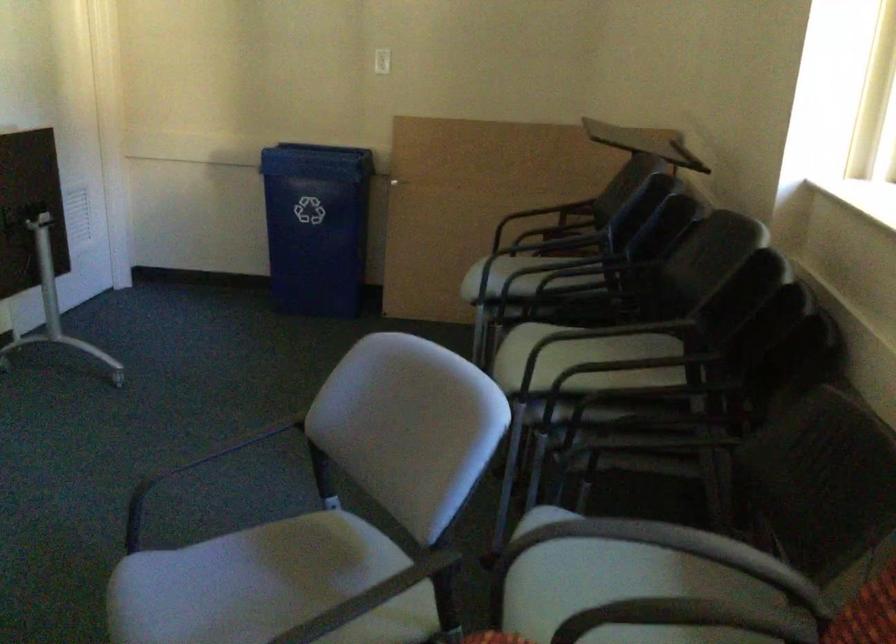
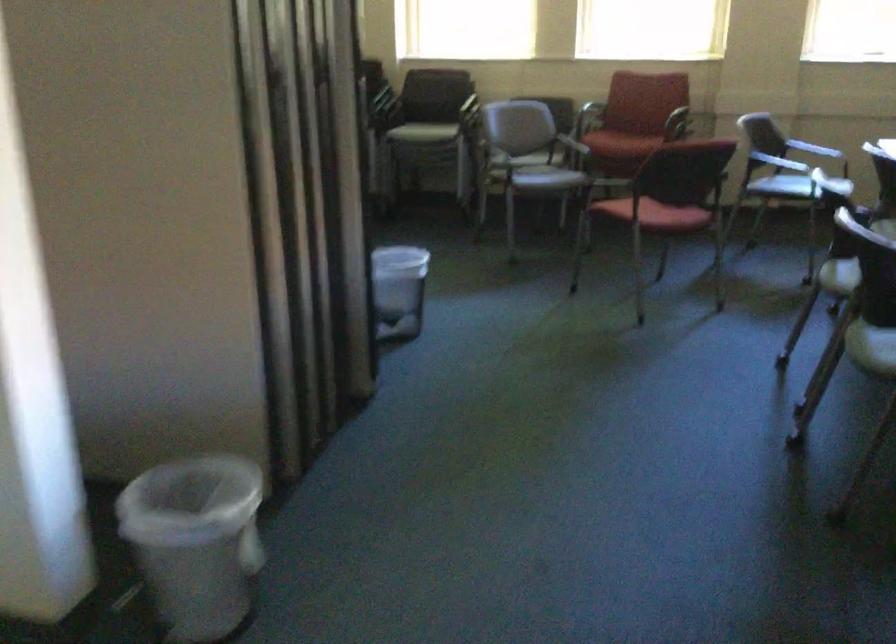
Question: I am providing you with two images of the same scene from different viewpoints. Which of the following objects are not visible in image2?

Choices:
 (A) grey chair sitting surface
 (B) black chair armrest
 (C) plastic trash can
 (D) red box

Answer: (B)